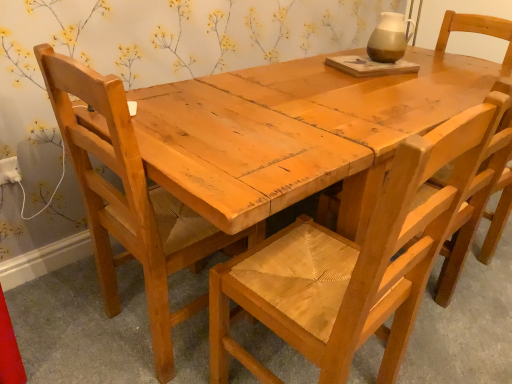
Question: From their relative heights in the image, would you say natural wood chair at left, marked as the third chair in a right-to-left arrangement, is taller or shorter than white plastic electric outlet at lower left?

Choices:
 (A) short
 (B) tall

Answer: (B)

Question: From a real-world perspective, relative to white plastic electric outlet at lower left, is natural wood chair at left, marked as the third chair in a right-to-left arrangement, vertically above or below?

Choices:
 (A) below
 (B) above

Answer: (B)

Question: Which of these objects is positioned closest to the natural wood chair at left, marked as the third chair in a right-to-left arrangement?

Choices:
 (A) wooden woven seat at center, marked as the 1th chair in a right-to-left arrangement
 (B) natural wood chair at center, placed as the second chair when sorted from right to left
 (C) white plastic electric outlet at lower left

Answer: (B)

Question: Estimate the real-world distances between objects in this image. Which object is closer to the wooden woven seat at center, which is counted as the 3th chair, starting from the left?

Choices:
 (A) white plastic electric outlet at lower left
 (B) natural wood chair at left, marked as the third chair in a right-to-left arrangement
 (C) natural wood chair at center, which is counted as the 2th chair, starting from the left

Answer: (C)